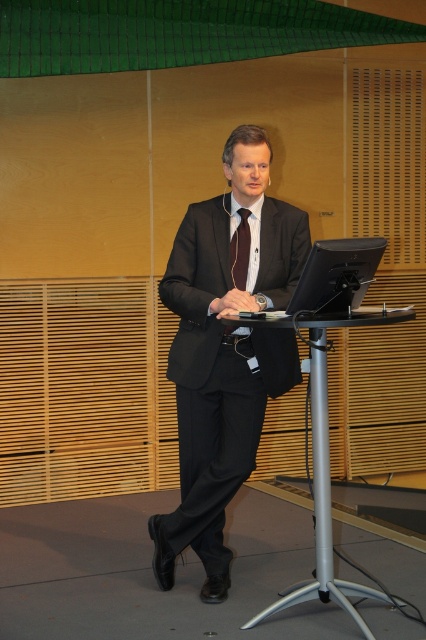
Looking at this image, is the position of black glossy monitor at center less distant than that of dark brown silk tie at center?

Yes, black glossy monitor at center is closer to the viewer.

Who is more forward, (291, 307) or (247, 273)?

Positioned in front is point (291, 307).

Find the location of a particular element. The image size is (426, 640). black glossy monitor at center is located at coordinates (336, 275).

Between matte black suit at center and dark brown silk tie at center, which one appears on the left side from the viewer's perspective?

matte black suit at center is more to the left.

Can you confirm if matte black suit at center is positioned below dark brown silk tie at center?

Correct, matte black suit at center is located below dark brown silk tie at center.

The height and width of the screenshot is (640, 426). What do you see at coordinates (224, 353) in the screenshot? I see `matte black suit at center` at bounding box center [224, 353].

Where is `matte black suit at center`? matte black suit at center is located at coordinates (224, 353).

Between matte black suit at center and silver metallic table at center, which one is positioned lower?

silver metallic table at center is below.

Does point (288, 272) lie behind point (331, 540)?

No, it is in front of (331, 540).

Locate an element on the screen. This screenshot has width=426, height=640. matte black suit at center is located at coordinates (224, 353).